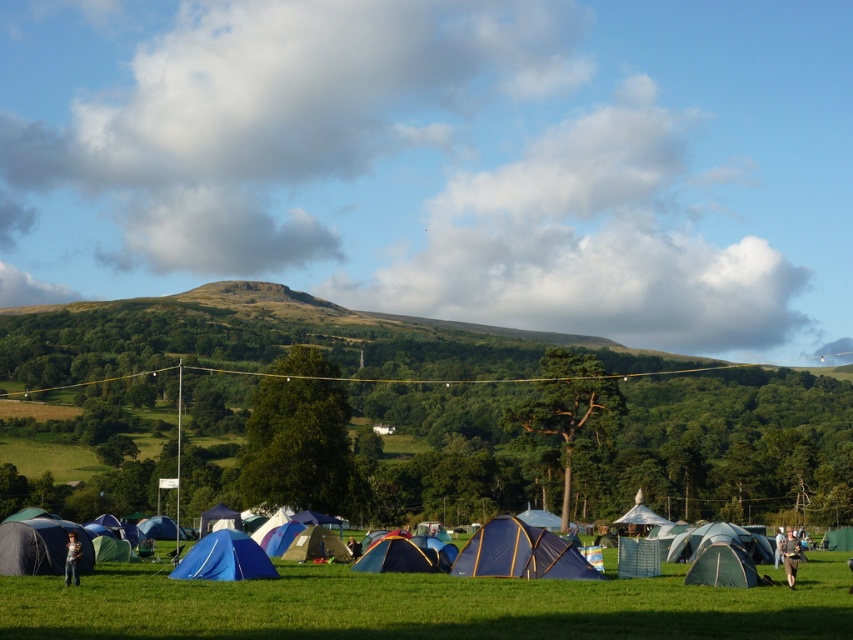
Is green fabric tent at center further to the viewer compared to light brown fabric jacket at lower right?

Yes, it is behind light brown fabric jacket at lower right.

Is green fabric tent at center taller than light brown fabric jacket at lower right?

No, green fabric tent at center is not taller than light brown fabric jacket at lower right.

Find the location of `green fabric tent at center`. green fabric tent at center is located at coordinates (722, 566).

Is the position of blue fabric tent at lower center less distant than that of light brown fabric jacket at lower right?

Yes, blue fabric tent at lower center is closer to the viewer.

Which is more to the left, blue fabric tent at lower center or light brown fabric jacket at lower right?

blue fabric tent at lower center

Is point (180, 576) behind point (788, 573)?

No, it is in front of (788, 573).

You are a GUI agent. You are given a task and a screenshot of the screen. Output one action in this format:
    pyautogui.click(x=<x>, y=<y>)
    Task: Click on the blue fabric tent at lower center
    The width and height of the screenshot is (853, 640).
    Given the screenshot: What is the action you would take?
    pyautogui.click(x=224, y=557)

Is point (544, 589) positioned before point (699, 577)?

Yes, point (544, 589) is in front of point (699, 577).

Measure the distance from blue fabric tents at lower center to green fabric tent at center.

blue fabric tents at lower center and green fabric tent at center are 7.89 meters apart from each other.

Who is more forward, [114,582] or [711,580]?

Point [114,582] is in front.

Identify the location of blue fabric tents at lower center. Image resolution: width=853 pixels, height=640 pixels. 552,580.